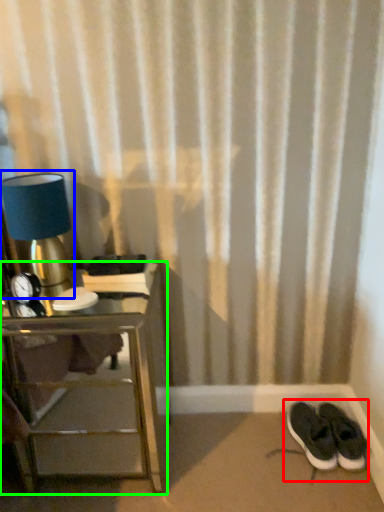
Question: Which object is positioned closest to footwear (highlighted by a red box)? Select from table lamp (highlighted by a blue box) and nightstand (highlighted by a green box).

Choices:
 (A) table lamp
 (B) nightstand

Answer: (B)